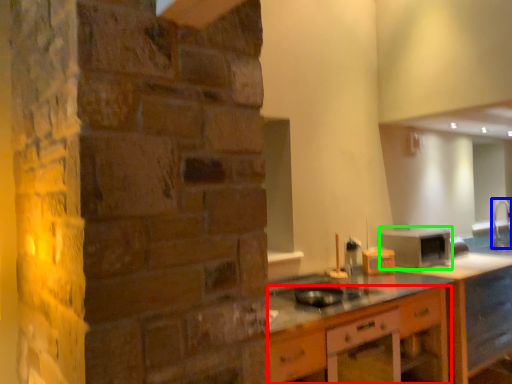
Question: Estimate the real-world distances between objects in this image. Which object is farther from cabinetry (highlighted by a red box), faucet (highlighted by a blue box) or appliance (highlighted by a green box)?

Choices:
 (A) faucet
 (B) appliance

Answer: (A)